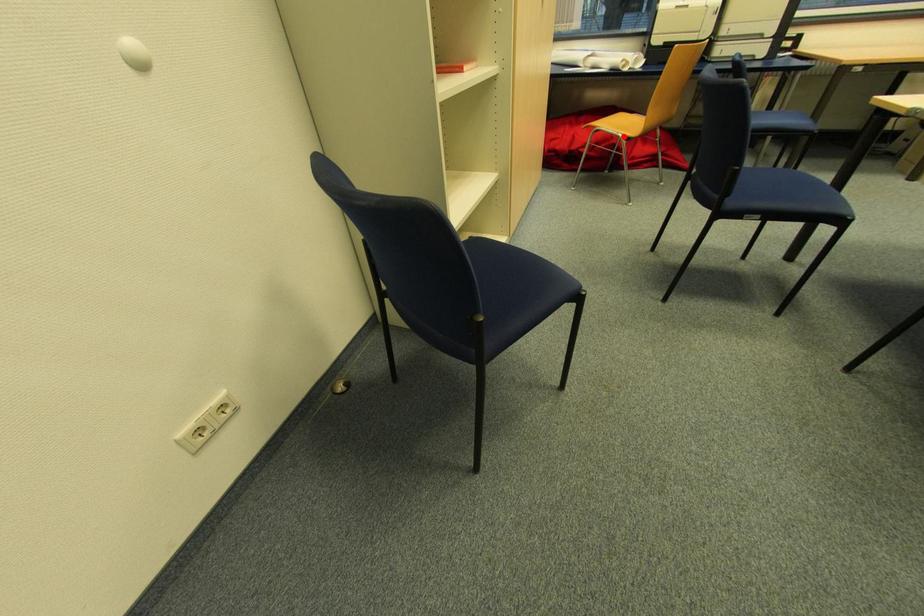
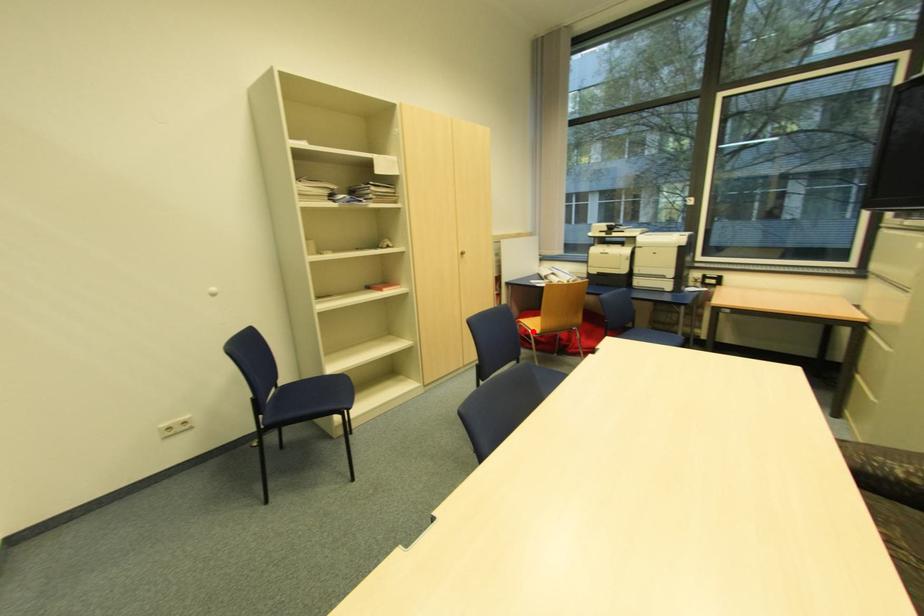
I am providing you with two images of the same scene from different viewpoints. A red point is marked on the first image and another point is marked on the second image. Do the highlighted points in image1 and image2 indicate the same real-world spot?

Yes